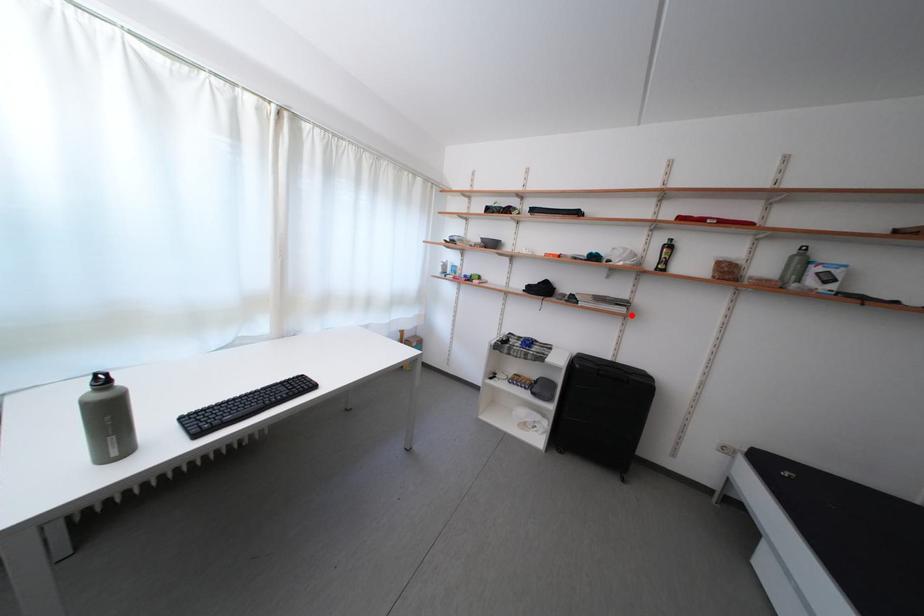
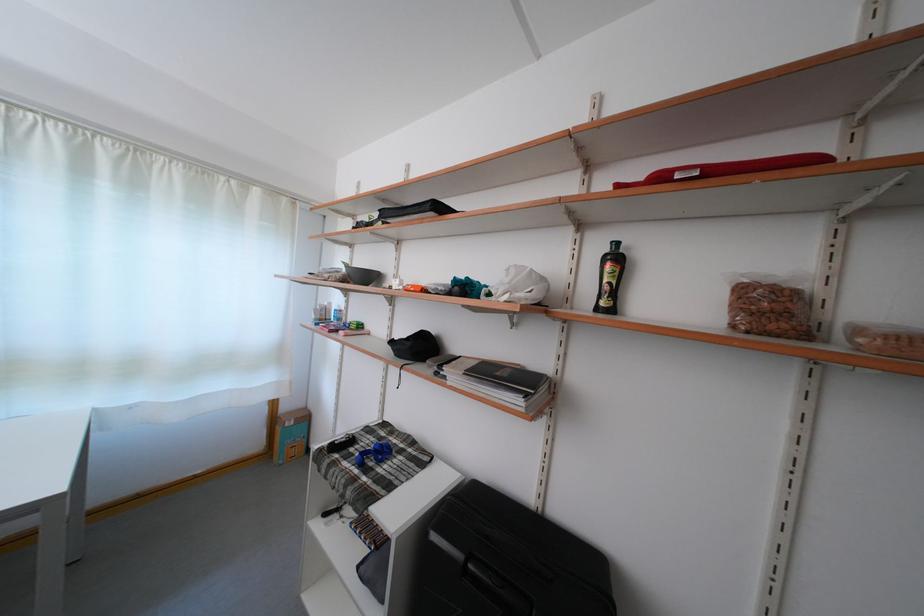
Locate, in the second image, the point that corresponds to the highlighted location in the first image.

(527, 408)